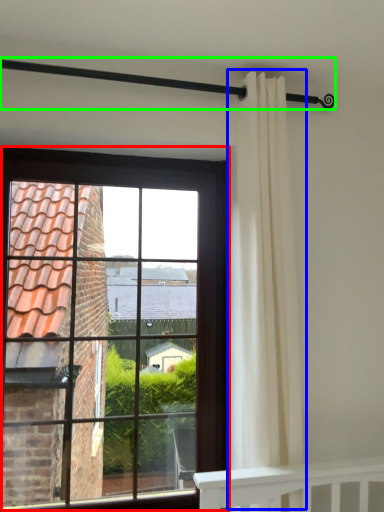
Question: Based on their relative distances, which object is farther from window (highlighted by a red box)? Choose from curtain (highlighted by a blue box) and balustrade (highlighted by a green box).

Choices:
 (A) curtain
 (B) balustrade

Answer: (B)